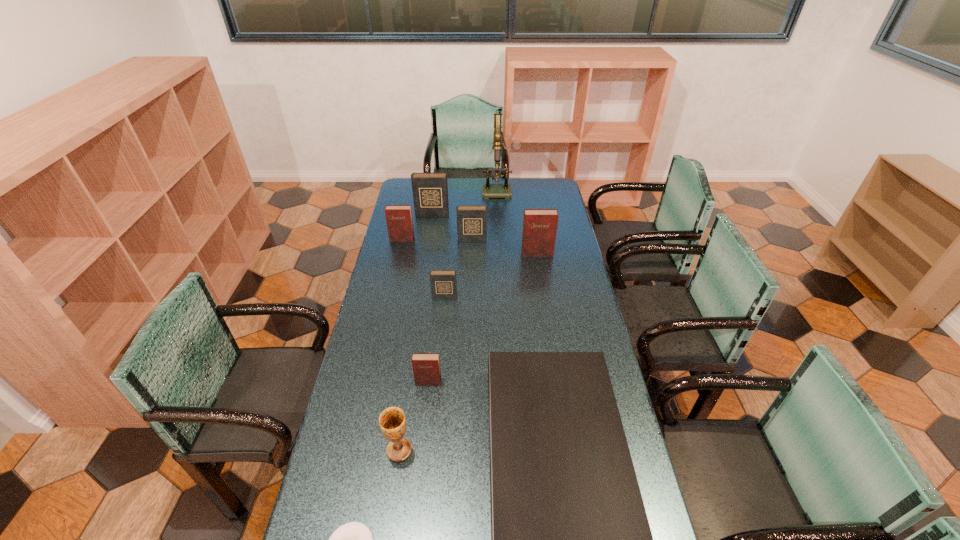
Find the location of a particular element. Image resolution: width=960 pixels, height=540 pixels. reddish-brown diary that is the second nearest to the second farthest reddish-brown diary is located at coordinates (426, 366).